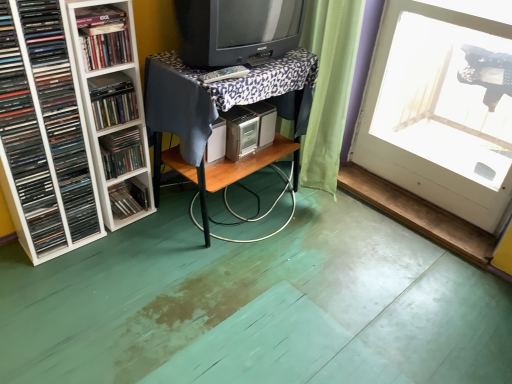
Question: From the image's perspective, is white plastic shelf at left, which appears as the 3th book when viewed from the top, located beneath wooden table at center, which is the second table from bottom to top?

Choices:
 (A) yes
 (B) no

Answer: (A)

Question: Is the surface of white plastic shelf at left, which appears as the 3th book when viewed from the top, in direct contact with wooden table at center, which is the second table from bottom to top?

Choices:
 (A) yes
 (B) no

Answer: (B)

Question: Is white plastic shelf at left, which appears as the 3th book when viewed from the top, further to camera compared to wooden table at center, the 1th table viewed from the top?

Choices:
 (A) yes
 (B) no

Answer: (B)

Question: Is white plastic shelf at left, which appears as the 3th book when viewed from the top, bigger than wooden table at center, which is the second table from bottom to top?

Choices:
 (A) no
 (B) yes

Answer: (A)

Question: Is white plastic shelf at left, the 3th book positioned from the bottom, outside wooden table at center, which is the second table from bottom to top?

Choices:
 (A) yes
 (B) no

Answer: (A)

Question: From their relative heights in the image, would you say matte black television at center is taller or shorter than matte black cd case at lower left, positioned as the first book in bottom-to-top order?

Choices:
 (A) short
 (B) tall

Answer: (B)

Question: Is matte black television at center in front of or behind matte black cd case at lower left, the 5th book from the top, in the image?

Choices:
 (A) front
 (B) behind

Answer: (A)

Question: From the image's perspective, is matte black television at center positioned above or below matte black cd case at lower left, the 5th book from the top?

Choices:
 (A) below
 (B) above

Answer: (B)

Question: From a real-world perspective, is matte black television at center physically located above or below matte black cd case at lower left, the 5th book from the top?

Choices:
 (A) above
 (B) below

Answer: (A)

Question: Is point (117, 77) positioned closer to the camera than point (79, 16)?

Choices:
 (A) closer
 (B) farther

Answer: (B)

Question: In the image, is matte black cd at left, positioned as the 2th book in top-to-bottom order, positioned in front of or behind matte black book at upper left, which ranks as the 5th book in bottom-to-top order?

Choices:
 (A) behind
 (B) front

Answer: (A)

Question: From a real-world perspective, is matte black cd at left, which is the fourth book in bottom-to-top order, positioned above or below matte black book at upper left, which ranks as the 5th book in bottom-to-top order?

Choices:
 (A) below
 (B) above

Answer: (A)

Question: Considering the positions of matte black cd at left, positioned as the 2th book in top-to-bottom order, and matte black book at upper left, which is counted as the 1th book, starting from the top, in the image, is matte black cd at left, positioned as the 2th book in top-to-bottom order, wider or thinner than matte black book at upper left, which is counted as the 1th book, starting from the top,?

Choices:
 (A) wide
 (B) thin

Answer: (B)

Question: Considering the positions of matte black book at upper left, which is counted as the 1th book, starting from the top, and matte plastic books at left, which is the fourth book in top-to-bottom order, in the image, is matte black book at upper left, which is counted as the 1th book, starting from the top, taller or shorter than matte plastic books at left, which is the fourth book in top-to-bottom order,?

Choices:
 (A) short
 (B) tall

Answer: (A)

Question: Would you say matte black book at upper left, which ranks as the 5th book in bottom-to-top order, is inside or outside matte plastic books at left, which is the fourth book in top-to-bottom order?

Choices:
 (A) inside
 (B) outside

Answer: (B)